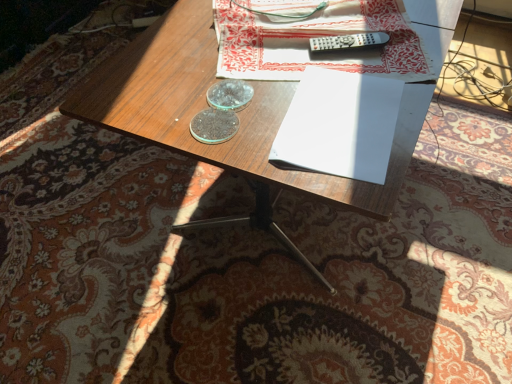
The height and width of the screenshot is (384, 512). I want to click on vacant region in front of black plastic remote at upper center, so click(x=366, y=83).